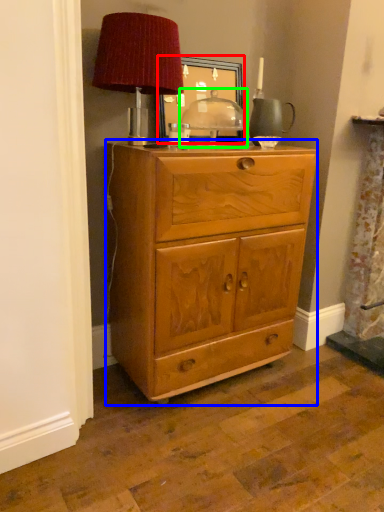
Question: Based on their relative distances, which object is nearer to picture frame (highlighted by a red box)? Choose from chest of drawers (highlighted by a blue box) and table (highlighted by a green box).

Choices:
 (A) chest of drawers
 (B) table

Answer: (B)